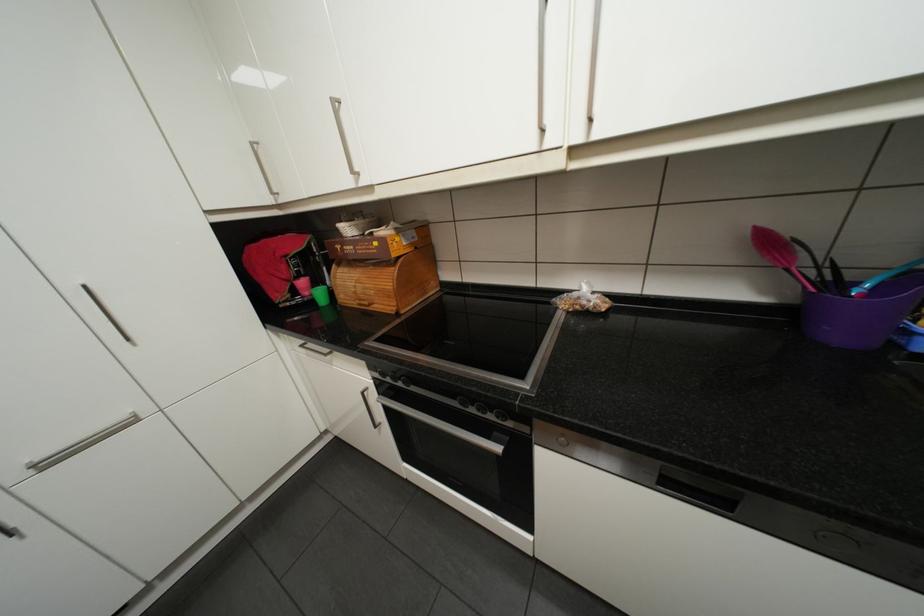
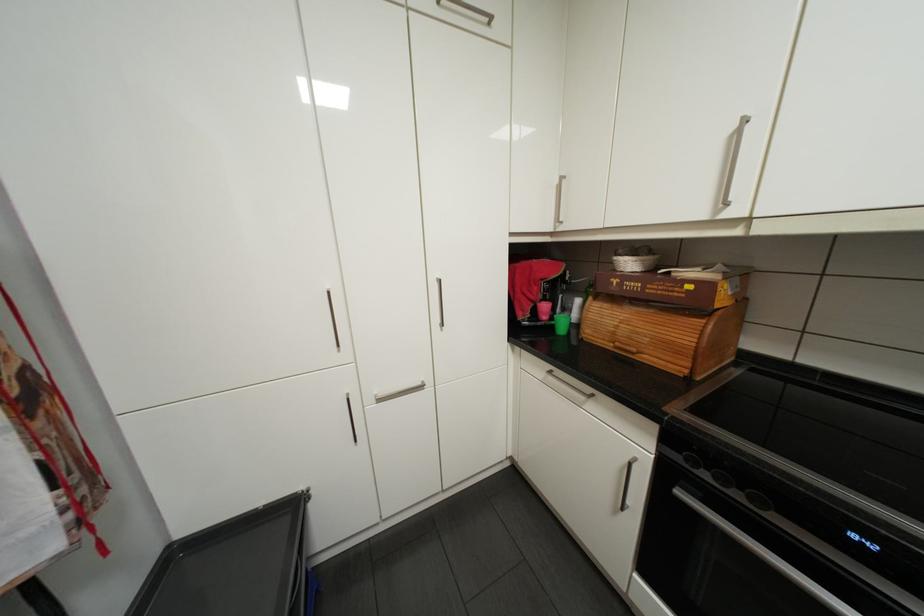
Find the pixel in the second image that matches the point at 355,229 in the first image.

(637, 262)